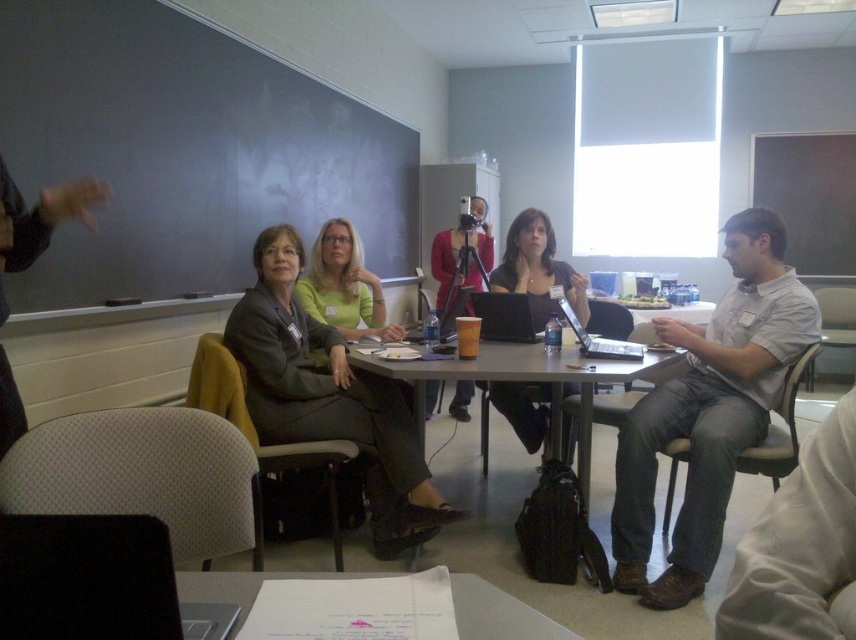
Can you confirm if matte green shirt at center is positioned to the right of matte black laptop at center?

No, matte green shirt at center is not to the right of matte black laptop at center.

Does matte green shirt at center have a lesser width compared to matte black laptop at center?

Incorrect, matte green shirt at center's width is not less than matte black laptop at center's.

The image size is (856, 640). Identify the location of matte green shirt at center. (343, 285).

You are a GUI agent. You are given a task and a screenshot of the screen. Output one action in this format:
    pyautogui.click(x=<x>, y=<y>)
    Task: Click on the matte green shirt at center
    The width and height of the screenshot is (856, 640).
    Given the screenshot: What is the action you would take?
    pyautogui.click(x=343, y=285)

Can you confirm if matte black jacket at center is bigger than white paper at center?

Actually, matte black jacket at center might be smaller than white paper at center.

Is matte black jacket at center wider than white paper at center?

No.

This screenshot has height=640, width=856. I want to click on matte black jacket at center, so click(x=538, y=268).

The height and width of the screenshot is (640, 856). Identify the location of matte black jacket at center. (538, 268).

Does matte black jacket at center have a smaller size compared to silver metallic laptop at center?

No.

Is matte black jacket at center above silver metallic laptop at center?

Yes.

Is point (514, 408) positioned before point (592, 356)?

No.

Locate an element on the screen. matte black jacket at center is located at coordinates (538, 268).